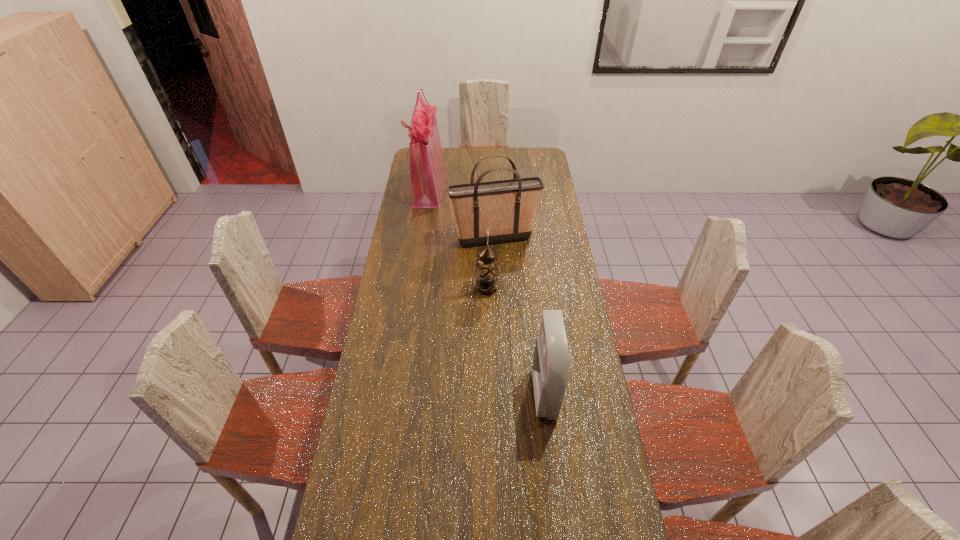
Identify the location of vacant space in between the nearest object and the second nearest object. (516, 341).

What are the coordinates of `object that stands as the third closest to the tallest object` in the screenshot? It's located at (551, 365).

Identify which object is the second closest to the nearer shopping bag. Please provide its 2D coordinates. Your answer should be formatted as a tuple, i.e. [(x, y)], where the tuple contains the x and y coordinates of a point satisfying the conditions above.

[(487, 271)]